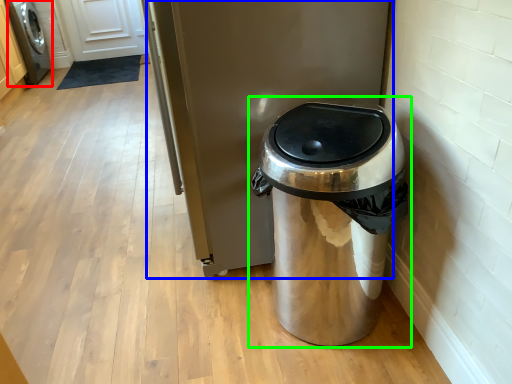
Question: Which object is positioned farthest from washing machine (highlighted by a red box)? Select from appliance (highlighted by a blue box) and waste container (highlighted by a green box).

Choices:
 (A) appliance
 (B) waste container

Answer: (B)